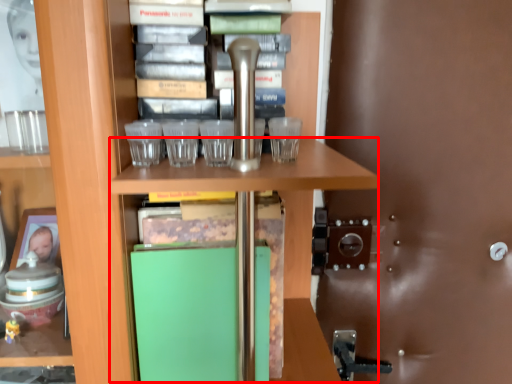
Question: From the image, what is the correct spatial relationship of table (annotated by the red box) in relation to glass door?

Choices:
 (A) left
 (B) right

Answer: (A)